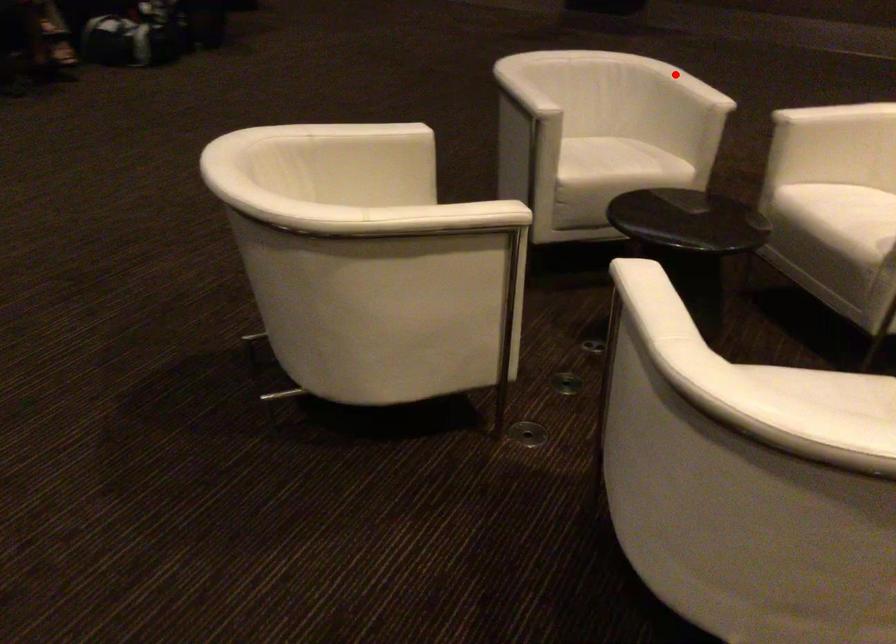
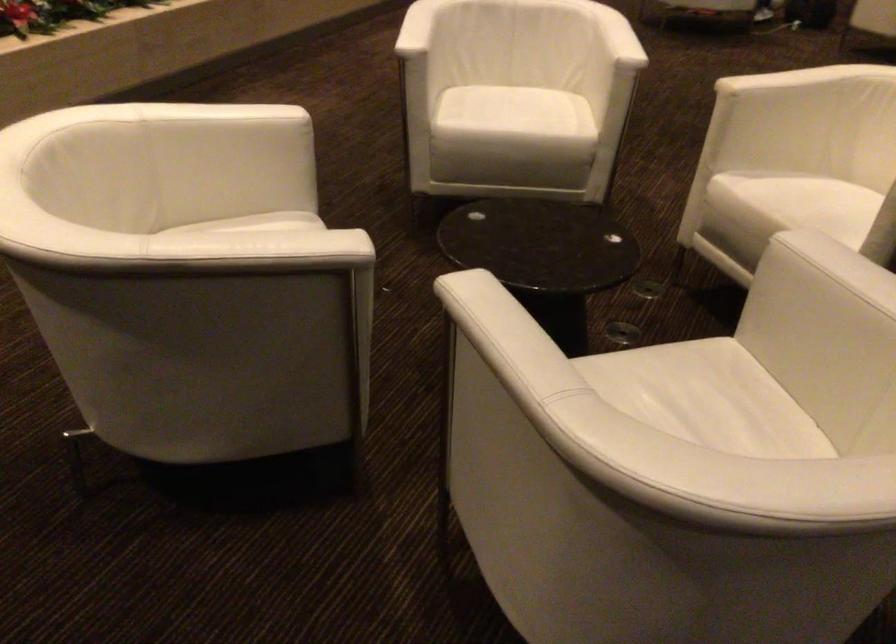
Question: I am providing you with two images of the same scene from different viewpoints. Given a red point in image1, look at the same physical point in image2. Is it:

Choices:
 (A) Closer to the viewpoint
 (B) Farther from the viewpoint

Answer: (A)